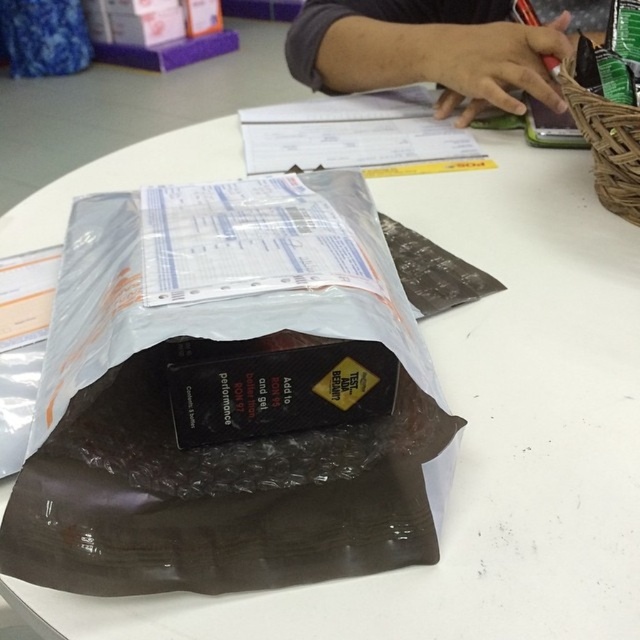
Question: Which of the following is the farthest from the observer?

Choices:
 (A) (472, 115)
 (B) (566, 77)

Answer: (A)

Question: Among these objects, which one is nearest to the camera?

Choices:
 (A) dark gray skin at upper center
 (B) woven brown basket at upper right

Answer: (B)

Question: Can you confirm if dark gray skin at upper center is positioned to the right of woven brown basket at upper right?

Choices:
 (A) yes
 (B) no

Answer: (B)

Question: Which of the following is the farthest from the observer?

Choices:
 (A) (496, 86)
 (B) (600, 141)

Answer: (A)

Question: Observing the image, what is the correct spatial positioning of dark gray skin at upper center in reference to woven brown basket at upper right?

Choices:
 (A) left
 (B) right

Answer: (A)

Question: From the image, what is the correct spatial relationship of dark gray skin at upper center in relation to woven brown basket at upper right?

Choices:
 (A) above
 (B) below

Answer: (A)